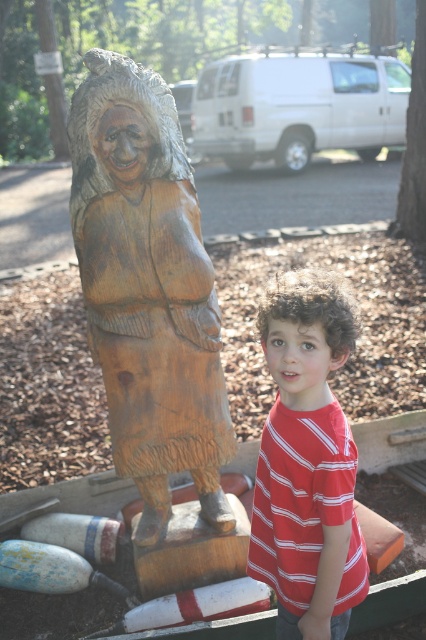
Does wooden carving at left have a smaller size compared to red striped shirt at center?

Actually, wooden carving at left might be larger than red striped shirt at center.

Is point (97, 172) positioned before point (273, 528)?

No, (97, 172) is behind (273, 528).

What do you see at coordinates (147, 289) in the screenshot? I see `wooden carving at left` at bounding box center [147, 289].

Identify the location of wooden carving at left. The image size is (426, 640). (147, 289).